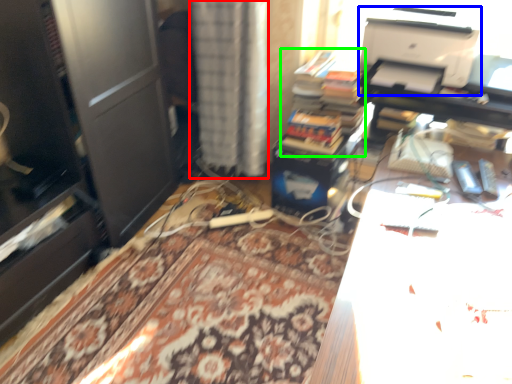
Question: Considering the real-world distances, which object is closest to curtain (highlighted by a red box)? printer (highlighted by a blue box) or book (highlighted by a green box).

Choices:
 (A) printer
 (B) book

Answer: (B)